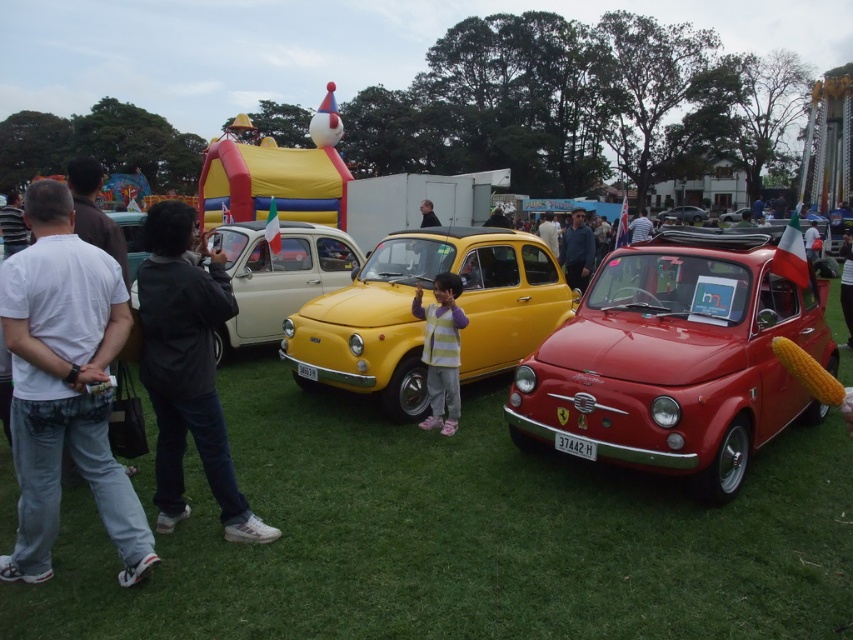
You are standing at the point marked as point (149, 348) in the image. You want to take a photo of the bright red Fiat 500 with the Italian flag on its roof. Is the car visible in your current position?

The point (149, 348) is 3.66 meters away from the viewer. Since the bright red Fiat 500 is in the foreground on the right side of the image, it should be visible from that distance unless obstructed by other objects. However, the description does not mention any obstructions, so the car is likely visible.

You are a photographer at the car show and want to take a picture of both the shiny red car at center and the striped fabric dress at center. Since you want both subjects to be clearly visible in the photo, will you need to adjust your position or the camera angle to ensure neither is blocking the other?

The shiny red car at center is in front of the striped fabric dress at center, so to capture both clearly without obstruction, you should adjust your position or angle to ensure the dress is visible behind the car or move the car or dress if possible.